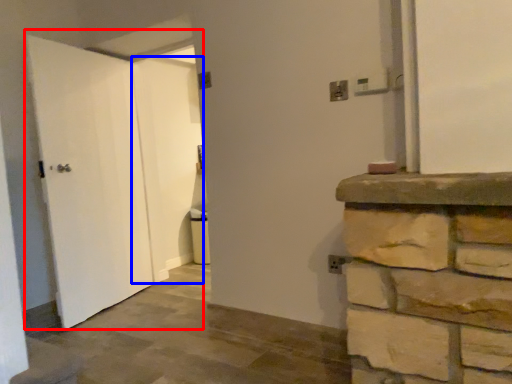
Question: Among these objects, which one is nearest to the camera, door (highlighted by a red box) or door (highlighted by a blue box)?

Choices:
 (A) door
 (B) door

Answer: (A)